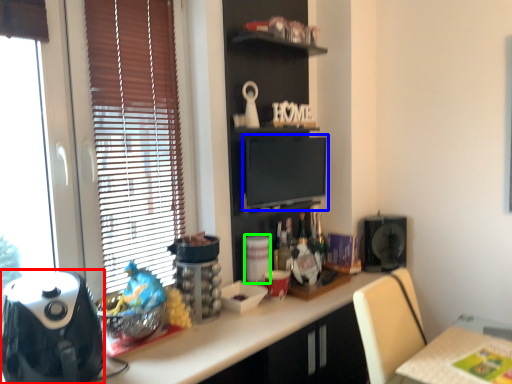
Question: Estimate the real-world distances between objects in this image. Which object is closer to appliance (highlighted by a red box), computer monitor (highlighted by a blue box) or appliance (highlighted by a green box)?

Choices:
 (A) computer monitor
 (B) appliance

Answer: (B)